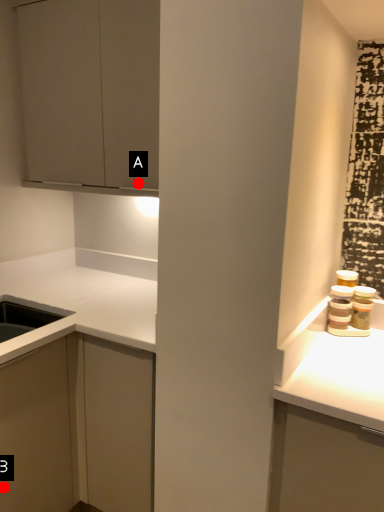
Question: Two points are circled on the image, labeled by A and B beside each circle. Which point is farther from the camera taking this photo?

Choices:
 (A) A is further
 (B) B is further

Answer: (A)